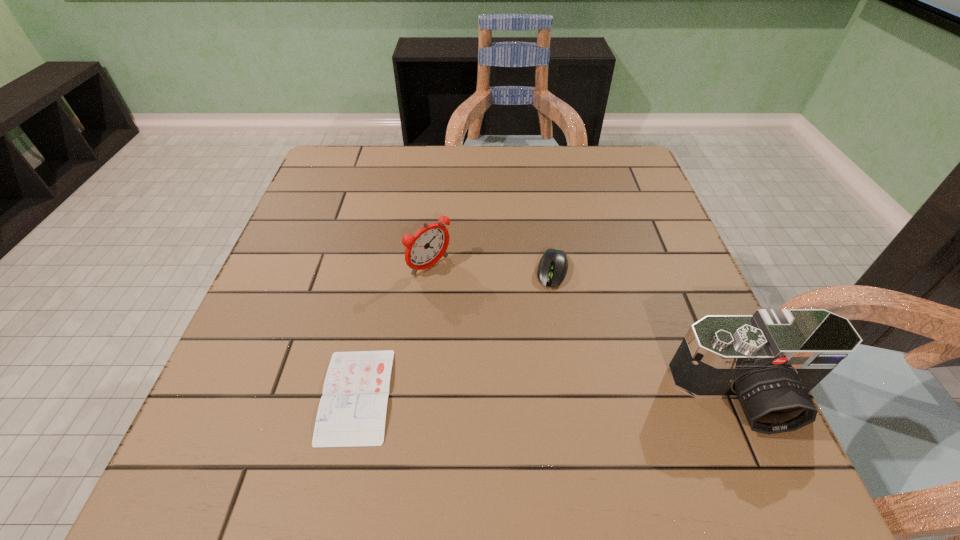
This screenshot has width=960, height=540. In order to click on free space at the right edge in this screenshot , I will do `click(638, 223)`.

Locate an element on the screen. free space at the far left corner is located at coordinates (362, 178).

I want to click on blank space at the far right corner of the desktop, so click(x=618, y=149).

This screenshot has width=960, height=540. What are the coordinates of `blank region between the camera and the third shortest object` in the screenshot? It's located at (588, 331).

Image resolution: width=960 pixels, height=540 pixels. In order to click on free space between the alarm clock and the second shortest object in this screenshot , I will do `click(492, 268)`.

I want to click on unoccupied position between the diary and the third tallest object, so click(454, 333).

Where is `vacant space that is in between the computer mouse and the second tallest object`? vacant space that is in between the computer mouse and the second tallest object is located at coordinates (492, 268).

Locate an element on the screen. free spot between the tallest object and the diary is located at coordinates (552, 395).

In order to click on free space between the third tallest object and the tallest object in this screenshot , I will do `click(650, 333)`.

The width and height of the screenshot is (960, 540). I want to click on free spot between the shortest object and the alarm clock, so click(x=394, y=331).